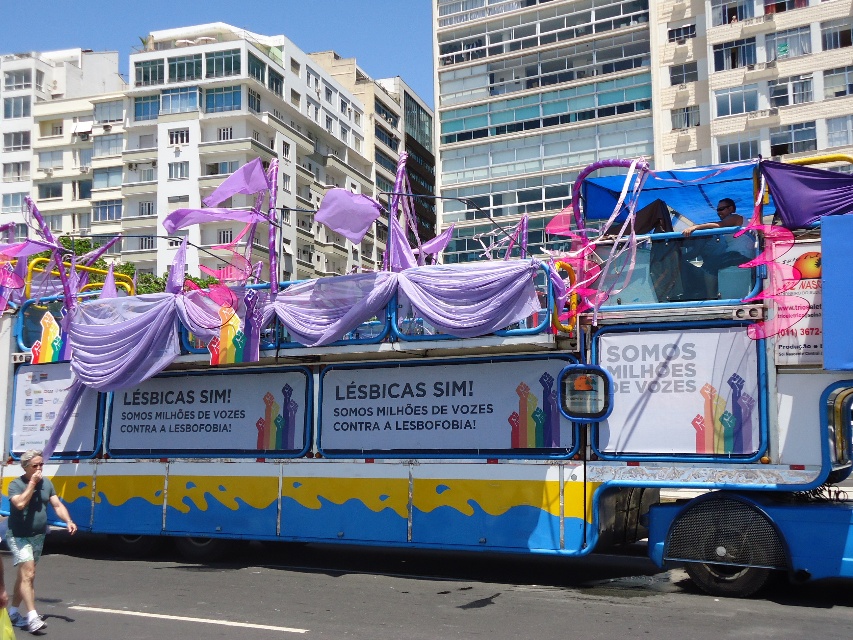
Question: Is matte purple fabric at center bigger than gray fabric shorts at lower left?

Choices:
 (A) no
 (B) yes

Answer: (A)

Question: Which of these objects is positioned closest to the matte purple fabric at center?

Choices:
 (A) matte blue shirt at center
 (B) gray fabric shorts at lower left

Answer: (A)

Question: Which of the following is the farthest from the observer?

Choices:
 (A) (711, 272)
 (B) (15, 508)

Answer: (A)

Question: Considering the real-world distances, which object is closest to the matte purple fabric at center?

Choices:
 (A) gray fabric shorts at lower left
 (B) matte blue shirt at center

Answer: (B)

Question: Is matte purple fabric at center to the right of matte blue shirt at center from the viewer's perspective?

Choices:
 (A) no
 (B) yes

Answer: (A)

Question: Can you confirm if matte purple fabric at center is positioned below matte blue shirt at center?

Choices:
 (A) no
 (B) yes

Answer: (B)